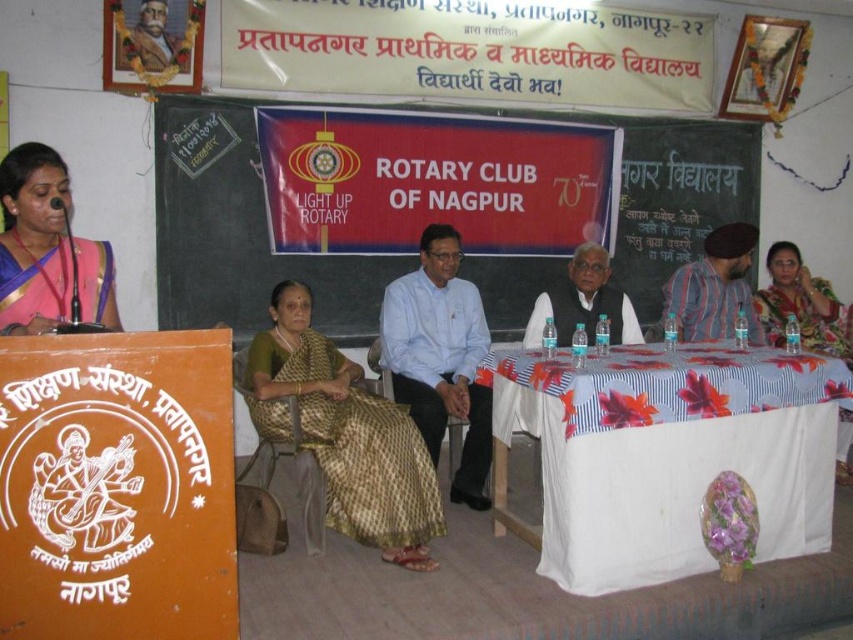
You are attending the Rotary Club of Nagpur event and notice two women wearing sarees. The gold brocade saree at center and the matte gold saree at right. Which woman is standing closer to the front of the stage?

The gold brocade saree at center is positioned under the matte gold saree at right, meaning the woman wearing the gold brocade saree at center is standing closer to the front of the stage.